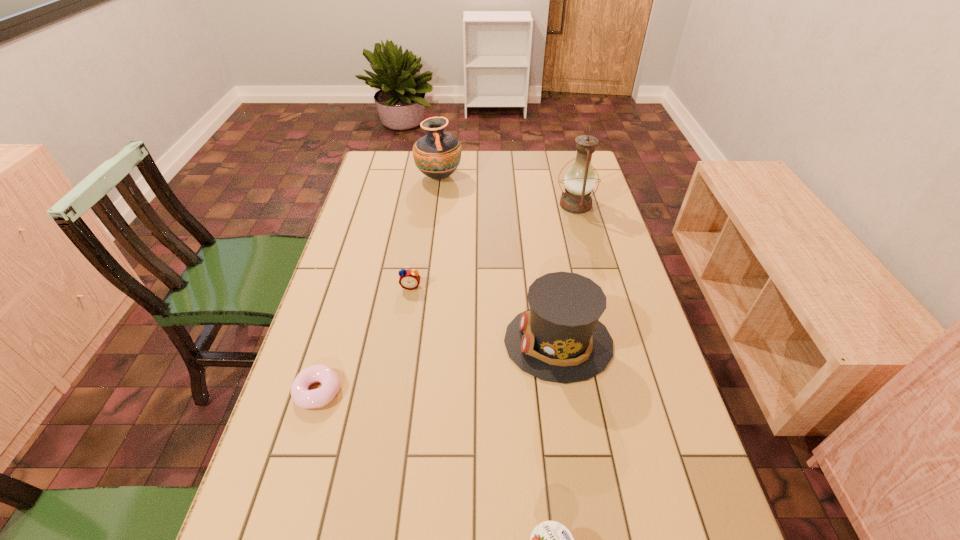
Find the location of a particular element. free spot at the left edge of the desktop is located at coordinates (394, 186).

In the image, there is a desktop. At what (x,y) coordinates should I click in order to perform the action: click on blank space at the right edge. Please return your answer as a coordinate pair (x, y). Looking at the image, I should click on (611, 380).

Locate an element on the screen. This screenshot has height=540, width=960. vacant space at the far left corner of the desktop is located at coordinates (368, 166).

Identify the location of vacant space at the far right corner of the desktop. The width and height of the screenshot is (960, 540). (551, 163).

This screenshot has height=540, width=960. In order to click on vacant space that's between the tallest object and the doughnut in this screenshot , I will do `click(446, 298)`.

Where is `free area in between the pottery and the alarm clock`? The height and width of the screenshot is (540, 960). free area in between the pottery and the alarm clock is located at coordinates click(425, 232).

Locate an element on the screen. The height and width of the screenshot is (540, 960). vacant area that lies between the third farthest object and the pottery is located at coordinates (425, 232).

Where is `free spot between the shortest object and the dress hat`? This screenshot has width=960, height=540. free spot between the shortest object and the dress hat is located at coordinates (438, 367).

This screenshot has height=540, width=960. I want to click on free space between the pottery and the alarm clock, so click(x=425, y=232).

This screenshot has width=960, height=540. In order to click on free space that is in between the pottery and the fourth nearest object in this screenshot , I will do `click(425, 232)`.